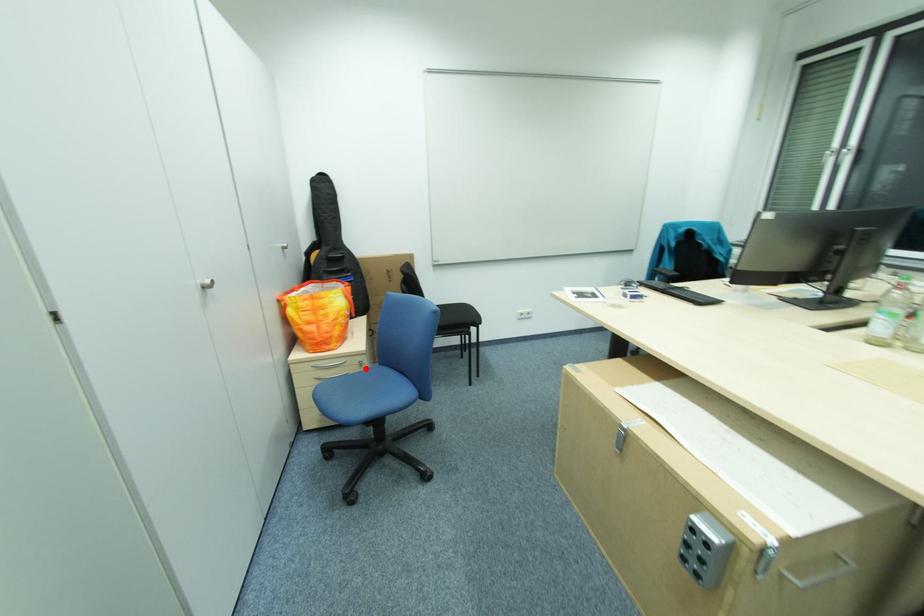
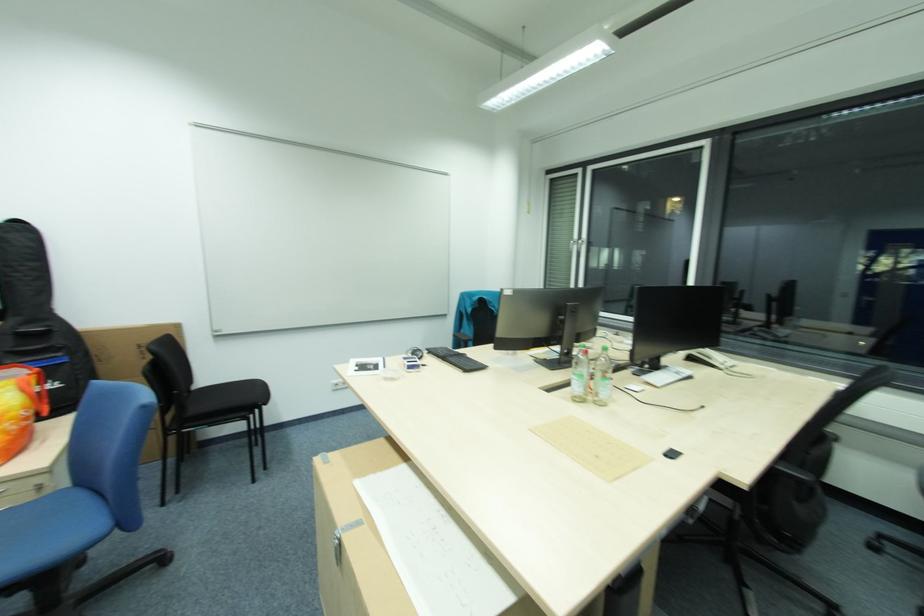
The point at the highlighted location is marked in the first image. Where is the corresponding point in the second image?

(37, 498)